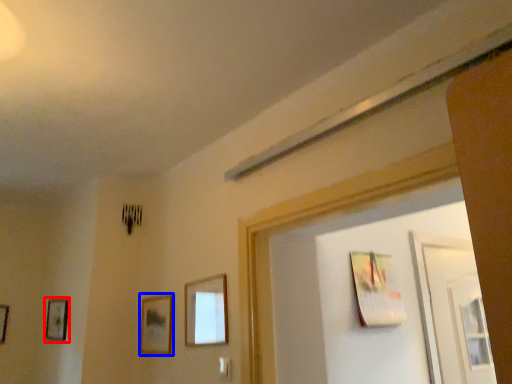
Question: Which object appears closest to the camera in this image, picture frame (highlighted by a red box) or picture frame (highlighted by a blue box)?

Choices:
 (A) picture frame
 (B) picture frame

Answer: (B)